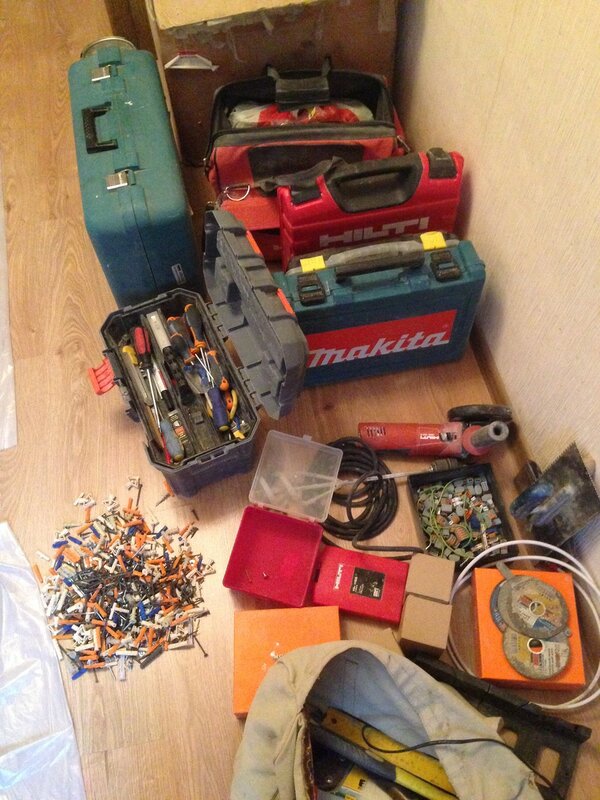
Where is `1 beige right wall`? 1 beige right wall is located at coordinates (540, 164).